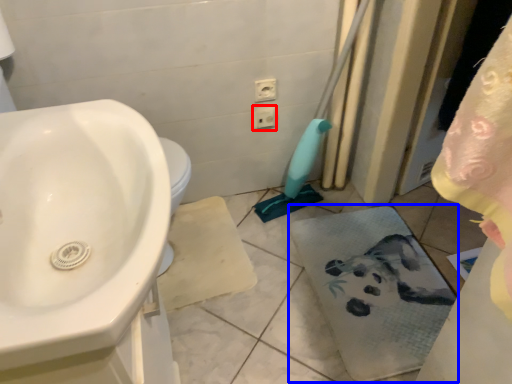
Question: Which point is further to the camera, electric outlet (highlighted by a red box) or bath towel (highlighted by a blue box)?

Choices:
 (A) electric outlet
 (B) bath towel

Answer: (A)